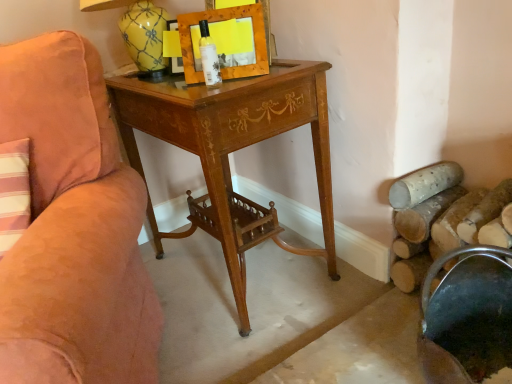
The height and width of the screenshot is (384, 512). In order to click on vacant space to the right of clear glass bottle at center in this screenshot , I will do `click(275, 74)`.